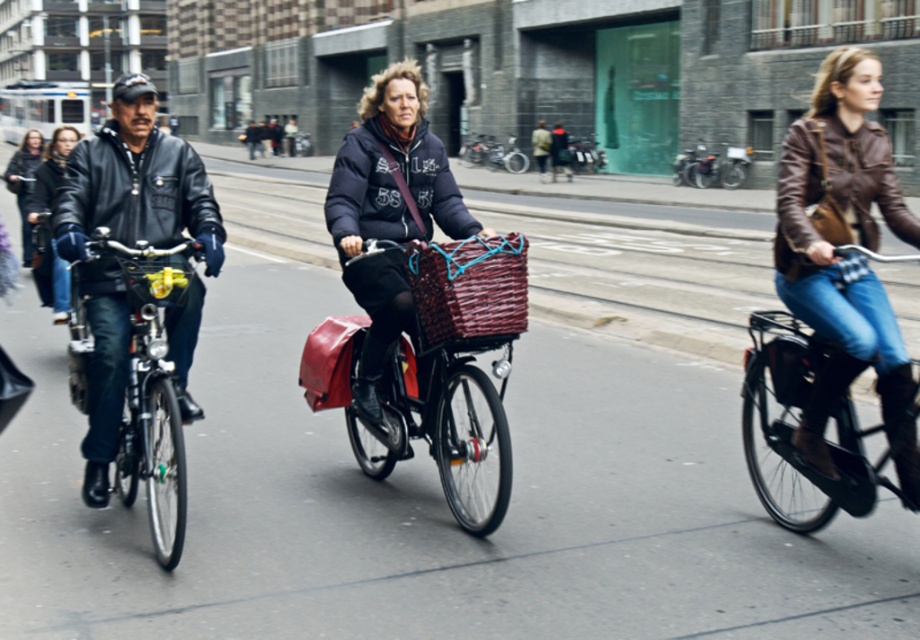
Who is positioned more to the right, matte black jacket at center or shiny black bicycle at center?

shiny black bicycle at center is more to the right.

From the picture: Is matte black jacket at center below shiny black bicycle at center?

Yes.

You are a GUI agent. You are given a task and a screenshot of the screen. Output one action in this format:
    pyautogui.click(x=<x>, y=<y>)
    Task: Click on the matte black jacket at center
    The image size is (920, 640).
    Given the screenshot: What is the action you would take?
    point(389,211)

Between point (454, 266) and point (677, 177), which one is positioned behind?

The point (677, 177) is behind.

Is woven brown basket at center to the right of metallic silver bicycle at center from the viewer's perspective?

No, woven brown basket at center is not to the right of metallic silver bicycle at center.

Who is more distant from viewer, [479,307] or [720,161]?

Point [720,161]

This screenshot has height=640, width=920. Identify the location of woven brown basket at center. (468, 288).

Who is positioned more to the right, shiny black bicycle at left or woven brown basket at center?

From the viewer's perspective, woven brown basket at center appears more on the right side.

Is shiny black bicycle at left to the right of woven brown basket at center from the viewer's perspective?

In fact, shiny black bicycle at left is to the left of woven brown basket at center.

Does point (158, 339) come closer to viewer compared to point (421, 333)?

That is True.

Find the location of `shiny black bicycle at left`. shiny black bicycle at left is located at coordinates (151, 387).